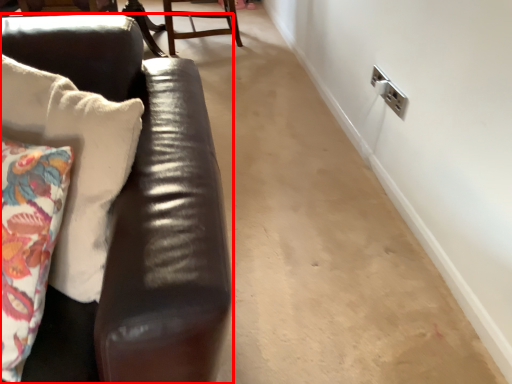
Question: Observing the image, what is the correct spatial positioning of studio couch (annotated by the red box) in reference to chair?

Choices:
 (A) left
 (B) right

Answer: (A)